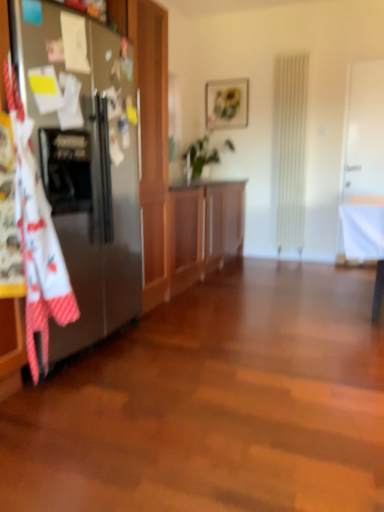
You are a GUI agent. You are given a task and a screenshot of the screen. Output one action in this format:
    pyautogui.click(x=<x>, y=<y>)
    Task: Click on the vacant space to the right of satin silver refrigerator at left
    Image resolution: width=384 pixels, height=512 pixels.
    Given the screenshot: What is the action you would take?
    pyautogui.click(x=201, y=358)